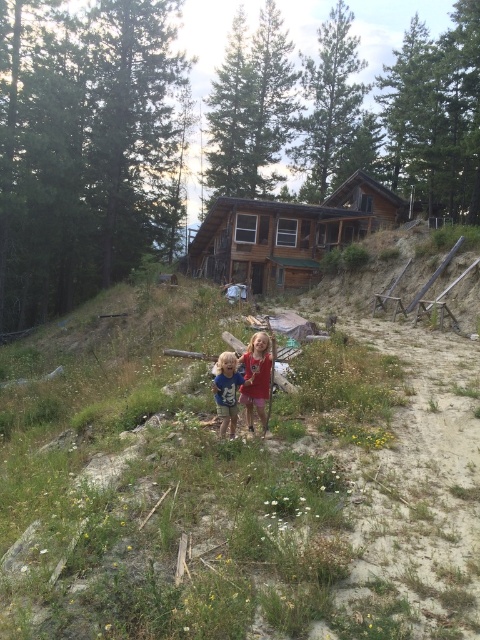
Based on the photo, you are a photographer positioned at the point closest to the camera. You want to take a photo of both the point at (470, 554) and the point at (264, 237). Which point should you focus on first to ensure both are in the frame?

You should focus on the point at (264, 237) first because it is behind the point at (470, 554), ensuring both are within the camera frame when adjusted properly.